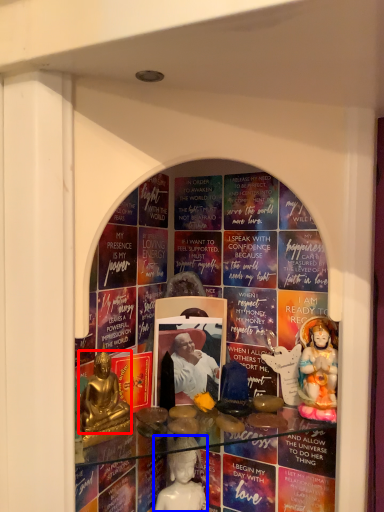
Question: Which of the following is the farthest to the observer, person (highlighted by a red box) or person (highlighted by a blue box)?

Choices:
 (A) person
 (B) person

Answer: (B)